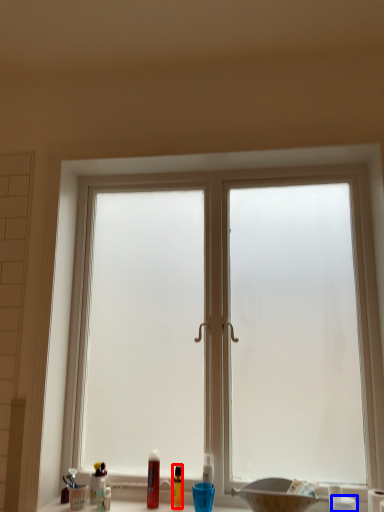
Question: Among these objects, which one is nearest to the camera, toiletry (highlighted by a red box) or toiletry (highlighted by a blue box)?

Choices:
 (A) toiletry
 (B) toiletry

Answer: (B)